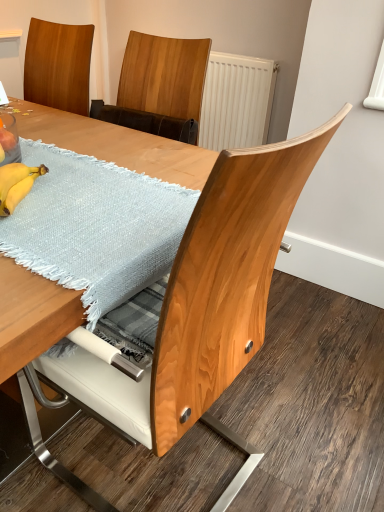
What are the coordinates of `free spot in front of yellow matte bananas at lower left` in the screenshot? It's located at (37, 250).